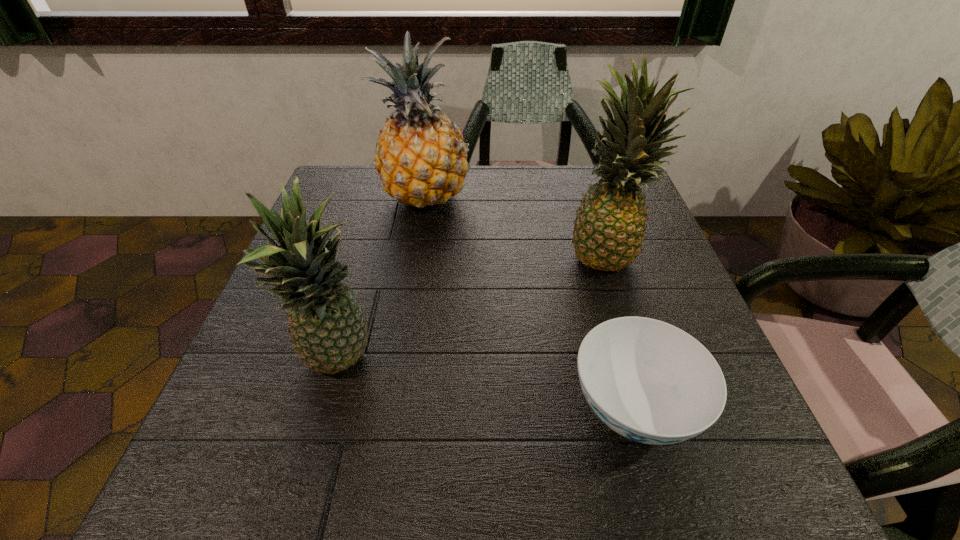
Locate which object ranks third in proximity to the shortest object. Please provide its 2D coordinates. Your answer should be formatted as a tuple, i.e. [(x, y)], where the tuple contains the x and y coordinates of a point satisfying the conditions above.

[(421, 159)]

I want to click on the second closest object relative to the second farthest pineapple, so click(x=421, y=159).

Identify which pineapple is the nearest to the farthest pineapple. Please provide its 2D coordinates. Your answer should be formatted as a tuple, i.e. [(x, y)], where the tuple contains the x and y coordinates of a point satisfying the conditions above.

[(609, 227)]

Locate which pineapple ranks in proximity to the farthest pineapple. Please provide its 2D coordinates. Your answer should be formatted as a tuple, i.e. [(x, y)], where the tuple contains the x and y coordinates of a point satisfying the conditions above.

[(609, 227)]

Where is `free location that satisfies the following two spatial constraints: 1. on the front side of the farthest object; 2. on the left side of the shortest object`? This screenshot has width=960, height=540. free location that satisfies the following two spatial constraints: 1. on the front side of the farthest object; 2. on the left side of the shortest object is located at coordinates (392, 409).

The width and height of the screenshot is (960, 540). In order to click on vacant space that satisfies the following two spatial constraints: 1. on the front side of the chinaware; 2. on the left side of the nearest pineapple in this screenshot , I will do `click(326, 409)`.

Image resolution: width=960 pixels, height=540 pixels. What are the coordinates of `free location that satisfies the following two spatial constraints: 1. on the front side of the nearest pineapple; 2. on the right side of the chinaware` in the screenshot? It's located at (326, 409).

Locate an element on the screen. The width and height of the screenshot is (960, 540). vacant space that satisfies the following two spatial constraints: 1. on the back side of the second farthest pineapple; 2. on the left side of the nearest pineapple is located at coordinates (371, 255).

The image size is (960, 540). I want to click on free space that satisfies the following two spatial constraints: 1. on the back side of the second farthest pineapple; 2. on the left side of the chinaware, so click(x=589, y=255).

Find the location of a particular element. This screenshot has width=960, height=540. free space that satisfies the following two spatial constraints: 1. on the back side of the rightmost pineapple; 2. on the right side of the chinaware is located at coordinates (589, 255).